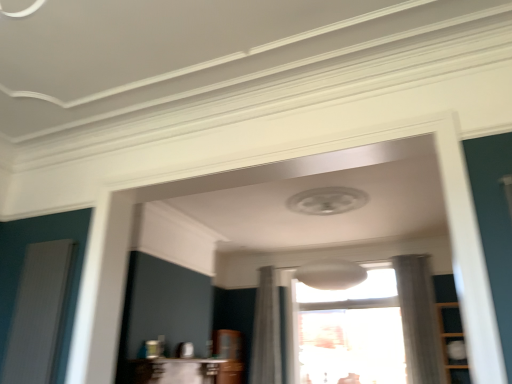
Question: Is white ribbed screen door at left completely or partially inside white sheer curtain at right, which is the first curtain in right-to-left order?

Choices:
 (A) no
 (B) yes

Answer: (A)

Question: Is white sheer curtain at right, which is the first curtain in right-to-left order, to the right of white ribbed screen door at left from the viewer's perspective?

Choices:
 (A) no
 (B) yes

Answer: (B)

Question: Is white sheer curtain at right, which is the first curtain in right-to-left order, aimed at white ribbed screen door at left?

Choices:
 (A) yes
 (B) no

Answer: (B)

Question: Can you confirm if white sheer curtain at right, arranged as the second curtain when viewed from the left, is smaller than white ribbed screen door at left?

Choices:
 (A) yes
 (B) no

Answer: (B)

Question: Does white sheer curtain at right, arranged as the second curtain when viewed from the left, have a greater height compared to white ribbed screen door at left?

Choices:
 (A) yes
 (B) no

Answer: (A)

Question: Which is correct: white sheer curtain at center, which ranks as the second curtain in right-to-left order, is inside white ribbed screen door at left, or outside of it?

Choices:
 (A) inside
 (B) outside

Answer: (B)

Question: In terms of width, does white sheer curtain at center, which ranks as the second curtain in right-to-left order, look wider or thinner when compared to white ribbed screen door at left?

Choices:
 (A) wide
 (B) thin

Answer: (A)

Question: From a real-world perspective, relative to white ribbed screen door at left, is white sheer curtain at center, which ranks as the second curtain in right-to-left order, vertically above or below?

Choices:
 (A) above
 (B) below

Answer: (A)

Question: Based on their sizes in the image, would you say white sheer curtain at center, which ranks as the second curtain in right-to-left order, is bigger or smaller than white ribbed screen door at left?

Choices:
 (A) small
 (B) big

Answer: (B)

Question: Considering the positions of white sheer curtain at right, which is the first curtain in right-to-left order, and white ribbed screen door at left in the image, is white sheer curtain at right, which is the first curtain in right-to-left order, bigger or smaller than white ribbed screen door at left?

Choices:
 (A) big
 (B) small

Answer: (A)

Question: Is white sheer curtain at right, arranged as the second curtain when viewed from the left, inside the boundaries of white ribbed screen door at left, or outside?

Choices:
 (A) outside
 (B) inside

Answer: (A)

Question: Is white sheer curtain at right, which is the first curtain in right-to-left order, in front of or behind white ribbed screen door at left in the image?

Choices:
 (A) behind
 (B) front

Answer: (A)

Question: From the image's perspective, is white sheer curtain at right, arranged as the second curtain when viewed from the left, positioned above or below white ribbed screen door at left?

Choices:
 (A) below
 (B) above

Answer: (A)

Question: From the image's perspective, is white ribbed screen door at left located above or below transparent glass window at center?

Choices:
 (A) below
 (B) above

Answer: (B)

Question: Visually, is white ribbed screen door at left positioned to the left or to the right of transparent glass window at center?

Choices:
 (A) left
 (B) right

Answer: (A)